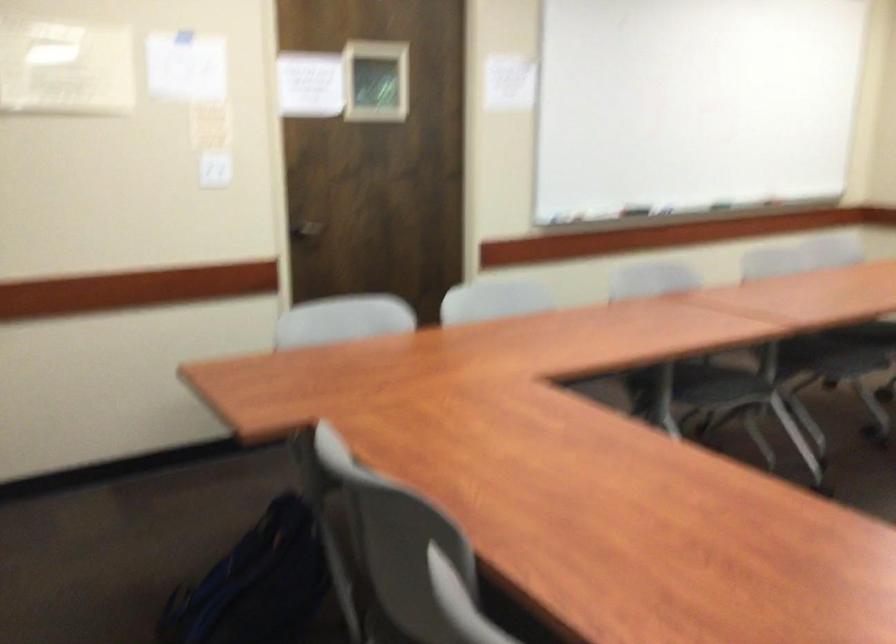
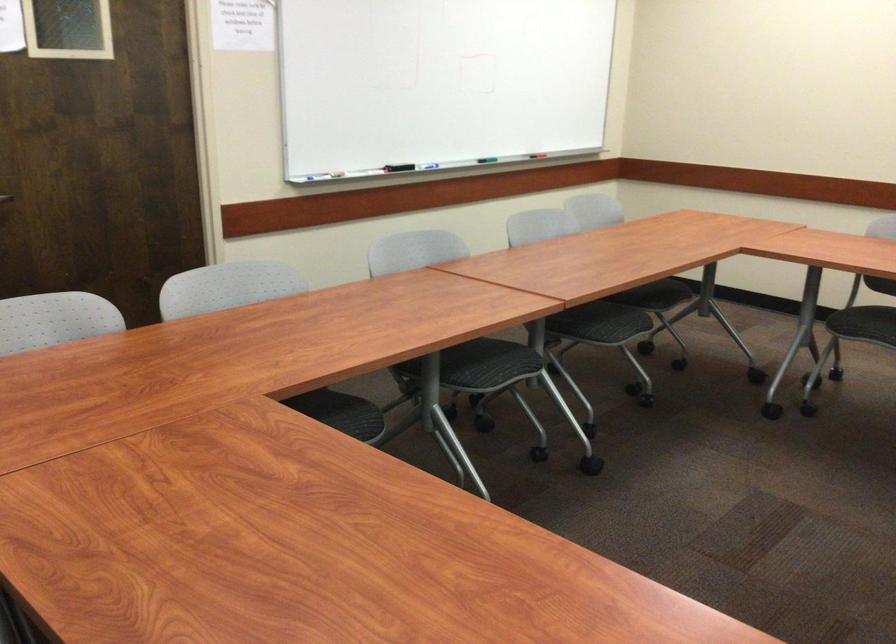
In the second image, find the point that corresponds to (686,128) in the first image.

(438, 82)